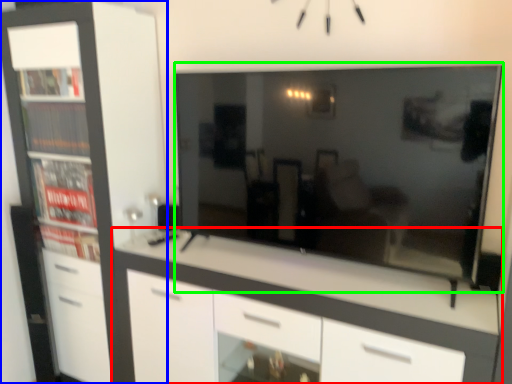
Question: Which object is the closest to the chest of drawers (highlighted by a red box)? Choose among these: cabinetry (highlighted by a blue box) or television (highlighted by a green box).

Choices:
 (A) cabinetry
 (B) television

Answer: (B)